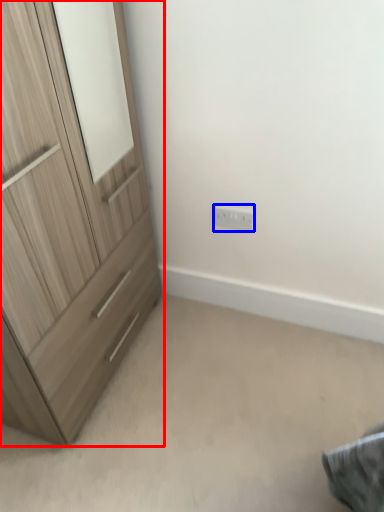
Question: Which of the following is the farthest to the observer, chest of drawers (highlighted by a red box) or electric outlet (highlighted by a blue box)?

Choices:
 (A) chest of drawers
 (B) electric outlet

Answer: (B)